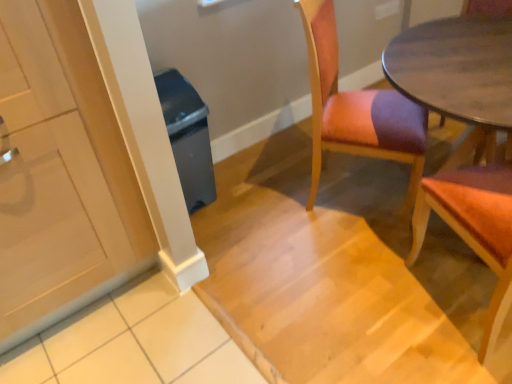
Where is `vacant space that's between wooden chair at right, marked as the first chair in a right-to-left arrangement, and gray plastic trash can at left`? vacant space that's between wooden chair at right, marked as the first chair in a right-to-left arrangement, and gray plastic trash can at left is located at coordinates (305, 246).